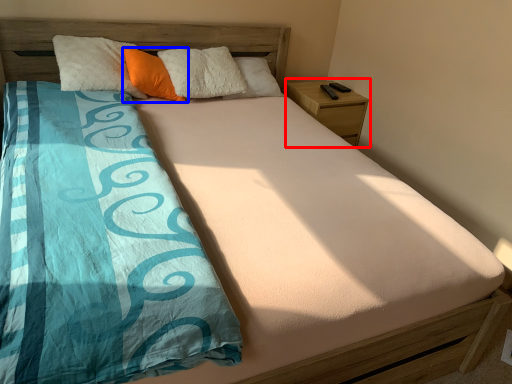
Question: Among these objects, which one is farthest to the camera, nightstand (highlighted by a red box) or pillow (highlighted by a blue box)?

Choices:
 (A) nightstand
 (B) pillow

Answer: (A)